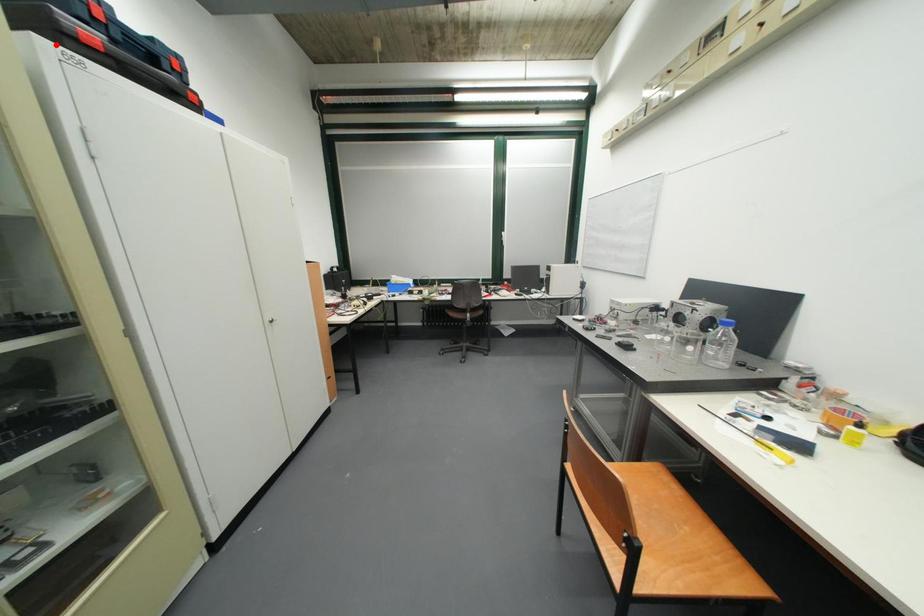
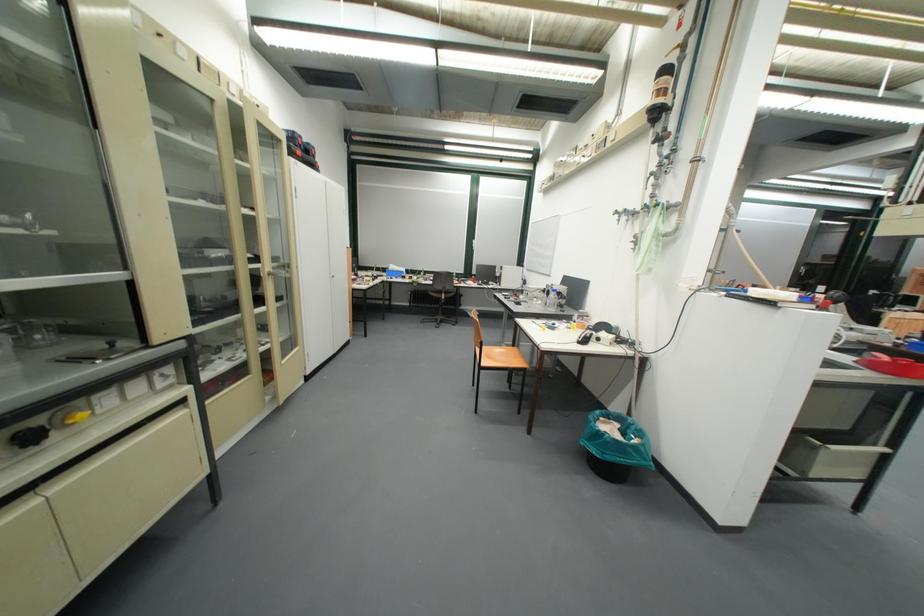
Locate, in the second image, the point that corresponds to the highlighted location in the first image.

(304, 161)